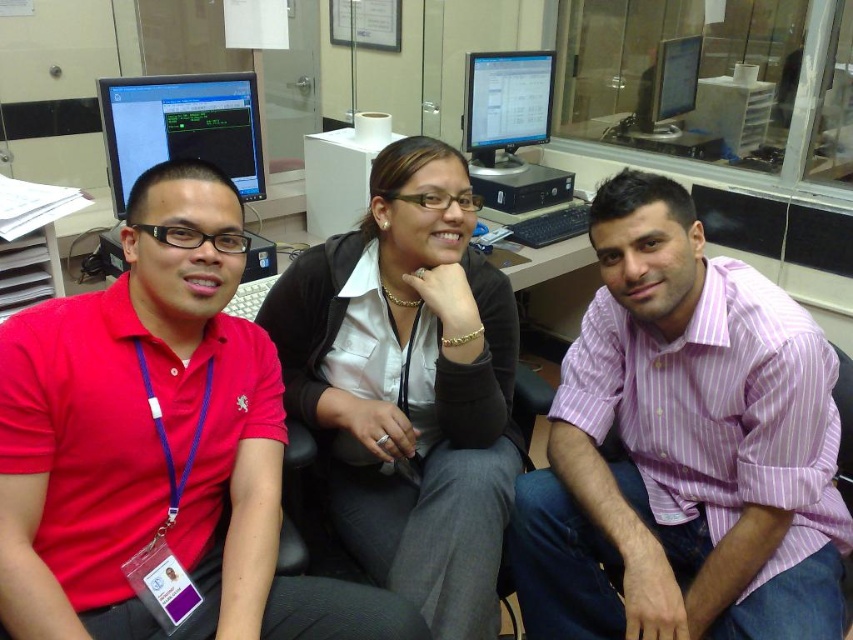
Looking at this image, can you confirm if matte red polo shirt at left is wider than matte black monitor at center?

Correct, the width of matte red polo shirt at left exceeds that of matte black monitor at center.

Is matte red polo shirt at left above matte black monitor at center?

No, matte red polo shirt at left is not above matte black monitor at center.

Is point (22, 403) more distant than point (535, 102)?

No, it is in front of (535, 102).

I want to click on matte red polo shirt at left, so click(155, 444).

Is point (412, 232) more distant than point (648, 67)?

No, it is in front of (648, 67).

I want to click on black matte shirt at center, so click(x=409, y=385).

Find the location of a particular element. The image size is (853, 640). black matte shirt at center is located at coordinates (409, 385).

Is matte black monitor at center below silver metallic monitor at upper right?

Indeed, matte black monitor at center is positioned under silver metallic monitor at upper right.

Is matte black monitor at center to the right of silver metallic monitor at upper right from the viewer's perspective?

In fact, matte black monitor at center is to the left of silver metallic monitor at upper right.

Does point (511, 129) lie behind point (668, 70)?

That is False.

This screenshot has width=853, height=640. Identify the location of matte black monitor at center. (506, 106).